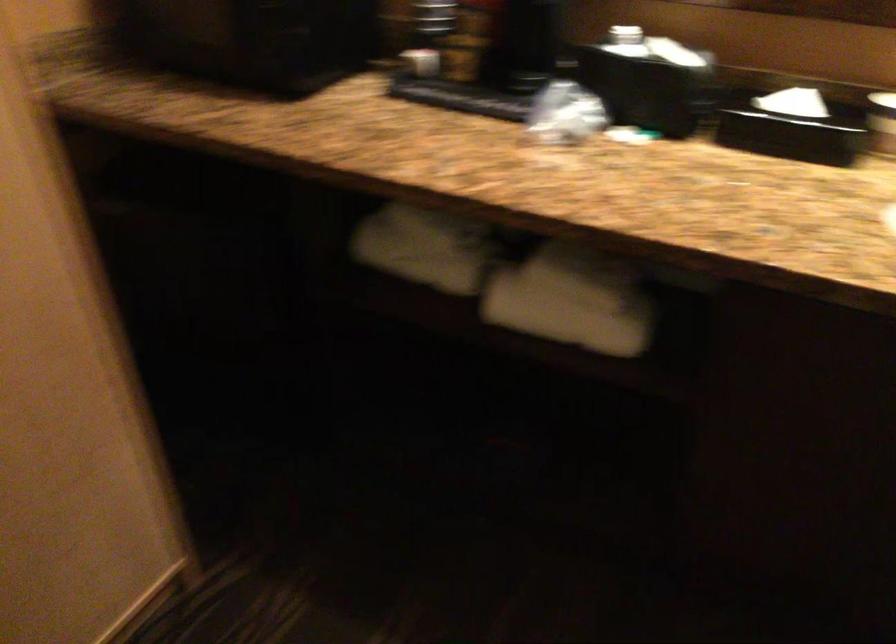
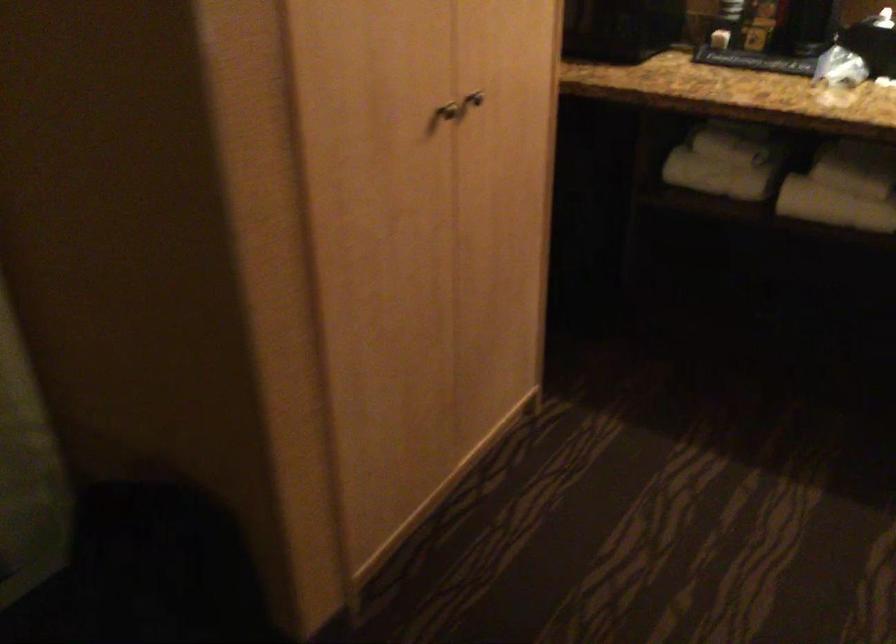
Based on the photo, what movement of the cameraman would produce the second image?

The cameraman walked toward left, backward.